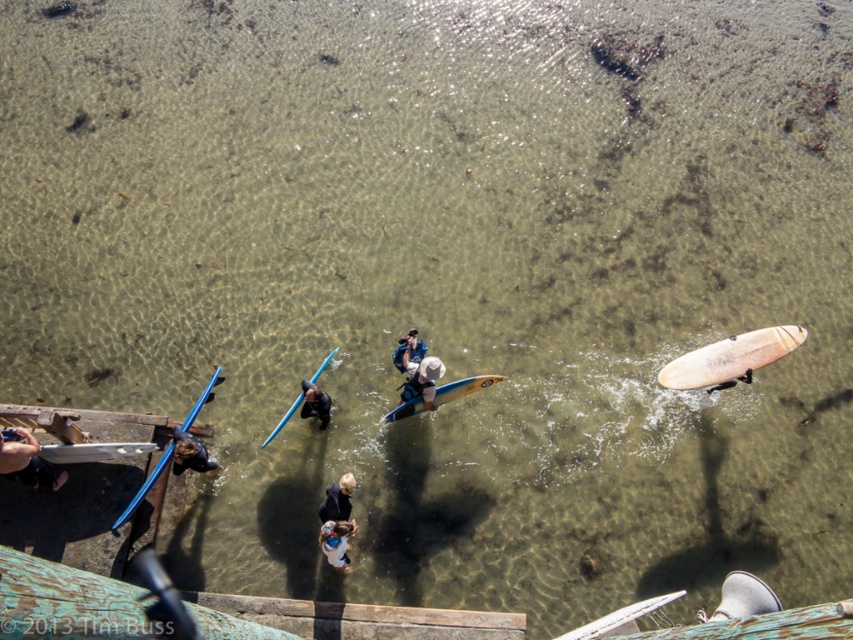
You are standing at the edge of the wooden structure and want to take a photo of both the white surfboard and the blue surfboard. The white surfboard is located at point (56, 460) and the blue surfboard is at point (183, 422). Since you want both in the frame, will you need to adjust your camera angle upwards or downwards to include both surfboards?

Point (56, 460) is closer to the camera than point (183, 422). To include both surfboards in the frame, you would need to adjust your camera angle downwards because the blue surfboard at point (183, 422) is further away and lower in the frame compared to the white surfboard closer to the camera.